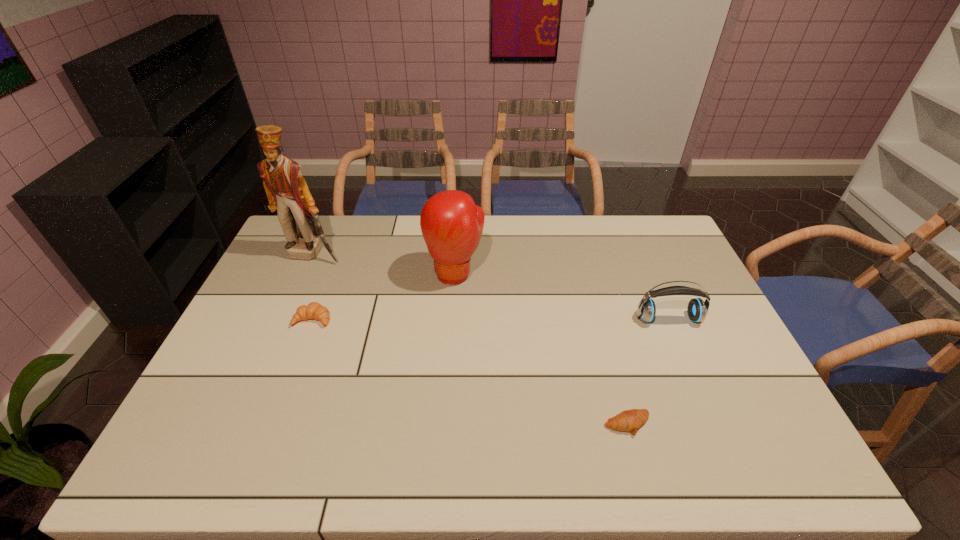
In the image, there is a desktop. Identify the location of vacant region at the near edge. The height and width of the screenshot is (540, 960). (461, 447).

Identify the location of free space at the right edge of the desktop. The height and width of the screenshot is (540, 960). (691, 272).

This screenshot has height=540, width=960. In the image, there is a desktop. Identify the location of vacant space at the far right corner. (663, 220).

You are a GUI agent. You are given a task and a screenshot of the screen. Output one action in this format:
    pyautogui.click(x=<x>, y=<y>)
    Task: Click on the free point between the nutcracker and the rightmost object
    Image resolution: width=960 pixels, height=540 pixels.
    Given the screenshot: What is the action you would take?
    pyautogui.click(x=491, y=286)

The image size is (960, 540). I want to click on vacant area that lies between the second object from right to left and the boxing glove, so click(x=541, y=349).

Locate an element on the screen. The image size is (960, 540). free spot between the second object from right to left and the left crescent roll is located at coordinates (x=470, y=372).

Find the location of a particular element. This screenshot has width=960, height=540. free space between the shorter crescent roll and the rightmost object is located at coordinates (648, 372).

Where is `empty space that is in between the taller crescent roll and the shortest object`? This screenshot has width=960, height=540. empty space that is in between the taller crescent roll and the shortest object is located at coordinates (470, 372).

This screenshot has width=960, height=540. What are the coordinates of `empty space between the tallest object and the rightmost object` in the screenshot? It's located at (491, 286).

Find the location of `free space between the farther crescent roll and the tallest object`. free space between the farther crescent roll and the tallest object is located at coordinates (313, 286).